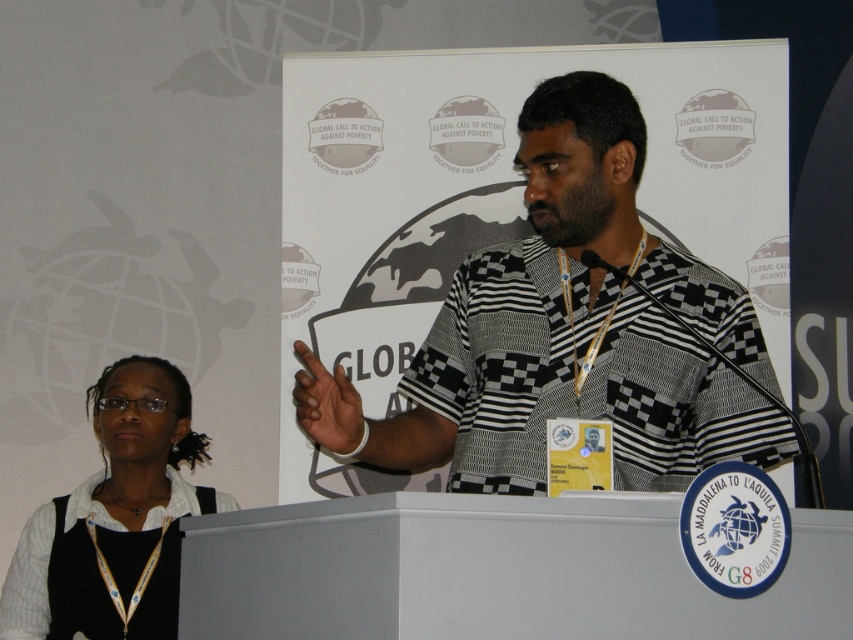
Question: Which point is closer to the camera taking this photo?

Choices:
 (A) (477, 477)
 (B) (61, 538)

Answer: (A)

Question: Does black and white checkered shirt at center have a larger size compared to white glossy shirt at lower left?

Choices:
 (A) no
 (B) yes

Answer: (B)

Question: Considering the relative positions of black and white checkered shirt at center and white glossy shirt at lower left in the image provided, where is black and white checkered shirt at center located with respect to white glossy shirt at lower left?

Choices:
 (A) left
 (B) right

Answer: (B)

Question: Can you confirm if black and white checkered shirt at center is thinner than white glossy shirt at lower left?

Choices:
 (A) yes
 (B) no

Answer: (B)